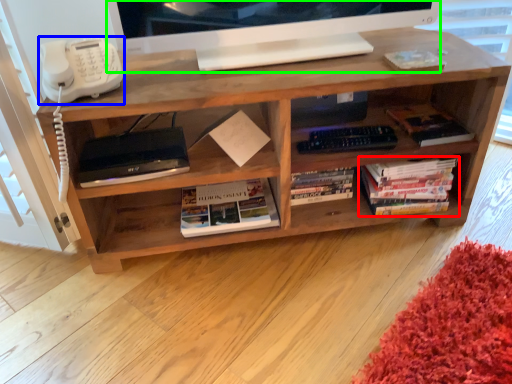
Question: Which object is positioned closest to book (highlighted by a red box)? Select from corded phone (highlighted by a blue box) and television (highlighted by a green box).

Choices:
 (A) corded phone
 (B) television

Answer: (B)